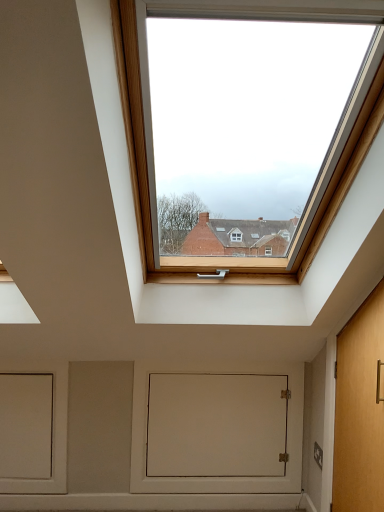
This screenshot has height=512, width=384. Find the location of `white matte door at center`. white matte door at center is located at coordinates (217, 425).

What do you see at coordinates (217, 425) in the screenshot? I see `white matte door at center` at bounding box center [217, 425].

Measure the distance between light brown wooden door at right and camera.

light brown wooden door at right and camera are 4.90 feet apart.

At what (x,y) coordinates should I click in order to perform the action: click on light brown wooden door at right. Please return your answer as a coordinate pair (x, y). Looking at the image, I should click on (360, 410).

Image resolution: width=384 pixels, height=512 pixels. Describe the element at coordinates (360, 410) in the screenshot. I see `light brown wooden door at right` at that location.

Locate an element on the screen. white matte door at center is located at coordinates click(217, 425).

Between white matte door at center and light brown wooden door at right, which one appears on the left side from the viewer's perspective?

white matte door at center is more to the left.

Between white matte door at center and light brown wooden door at right, which one is positioned in front?

light brown wooden door at right.

Considering the positions of point (217, 408) and point (370, 320), is point (217, 408) closer or farther from the camera than point (370, 320)?

Point (217, 408) is positioned farther from the camera compared to point (370, 320).

From the image's perspective, which is below, white matte door at center or light brown wooden door at right?

white matte door at center, from the image's perspective.

From a real-world perspective, is white matte door at center located higher than light brown wooden door at right?

No, from a real-world perspective, white matte door at center is not above light brown wooden door at right.

Considering the sizes of white matte door at center and light brown wooden door at right in the image, is white matte door at center wider or thinner than light brown wooden door at right?

Clearly, white matte door at center has less width compared to light brown wooden door at right.

Considering the relative sizes of white matte door at center and light brown wooden door at right in the image provided, is white matte door at center taller than light brown wooden door at right?

Incorrect, the height of white matte door at center is not larger of that of light brown wooden door at right.

Can you confirm if white matte door at center is bigger than light brown wooden door at right?

Actually, white matte door at center might be smaller than light brown wooden door at right.

Is white matte door at center not inside light brown wooden door at right?

Yes, white matte door at center is outside of light brown wooden door at right.

Consider the image. Is white matte door at center far from light brown wooden door at right?

They are positioned close to each other.

Is white matte door at center facing away from light brown wooden door at right?

No.

Can you tell me how much white matte door at center and light brown wooden door at right differ in facing direction?

90 degrees.

In the image, there is a light brown wooden door at right. In order to click on window screen below it (from the image's perspective) in this screenshot , I will do `click(217, 425)`.

Between light brown wooden door at right and white matte door at center, which one appears on the left side from the viewer's perspective?

From the viewer's perspective, white matte door at center appears more on the left side.

Who is more distant, light brown wooden door at right or white matte door at center?

Positioned behind is white matte door at center.

Is point (338, 394) positioned after point (267, 393)?

That is False.

From the image's perspective, is light brown wooden door at right positioned above or below white matte door at center?

From the image's perspective, light brown wooden door at right appears above white matte door at center.

Looking at this image, from a real-world perspective, does light brown wooden door at right stand above white matte door at center?

Indeed, from a real-world perspective, light brown wooden door at right stands above white matte door at center.

Between light brown wooden door at right and white matte door at center, which one has larger width?

light brown wooden door at right is wider.

Can you confirm if light brown wooden door at right is taller than white matte door at center?

Indeed, light brown wooden door at right has a greater height compared to white matte door at center.

Is light brown wooden door at right smaller than white matte door at center?

No, light brown wooden door at right is not smaller than white matte door at center.

Is light brown wooden door at right outside of white matte door at center?

That's correct, light brown wooden door at right is outside of white matte door at center.

Can you see light brown wooden door at right touching white matte door at center?

No, light brown wooden door at right is not beside white matte door at center.

Is light brown wooden door at right facing away from white matte door at center?

No, light brown wooden door at right is not facing the opposite direction of white matte door at center.

The height and width of the screenshot is (512, 384). Identify the location of window screen behind the light brown wooden door at right. click(217, 425).

You are a GUI agent. You are given a task and a screenshot of the screen. Output one action in this format:
    pyautogui.click(x=<x>, y=<y>)
    Task: Click on the window screen located below the light brown wooden door at right (from the image's perspective)
    The image size is (384, 512).
    Given the screenshot: What is the action you would take?
    pyautogui.click(x=217, y=425)

I want to click on window screen below the light brown wooden door at right (from a real-world perspective), so click(217, 425).